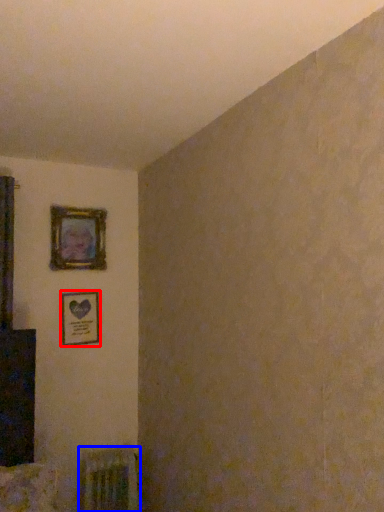
Question: Which object is closer to the camera taking this photo, picture frame (highlighted by a red box) or radiator (highlighted by a blue box)?

Choices:
 (A) picture frame
 (B) radiator

Answer: (B)